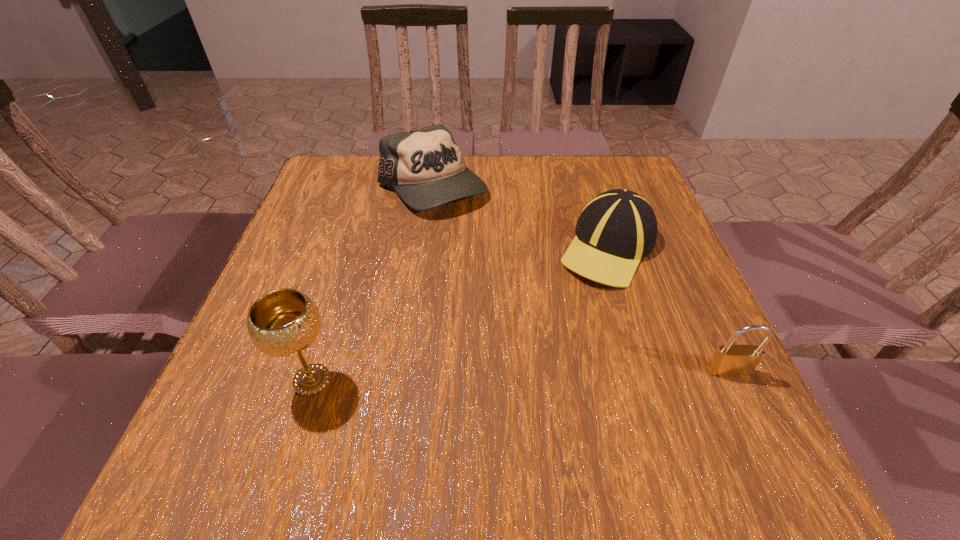
At what (x,y) coordinates should I click in order to perform the action: click on blank space located 0.240m on the front-facing side of the left baseball cap. Please return your answer as a coordinate pair (x, y). Looking at the image, I should click on (487, 282).

This screenshot has height=540, width=960. Find the location of `vacant space situated 0.230m on the front-facing side of the left baseball cap`. vacant space situated 0.230m on the front-facing side of the left baseball cap is located at coordinates (485, 279).

You are a GUI agent. You are given a task and a screenshot of the screen. Output one action in this format:
    pyautogui.click(x=<x>, y=<y>)
    Task: Click on the object situated at the far edge
    This screenshot has height=540, width=960.
    Given the screenshot: What is the action you would take?
    pyautogui.click(x=426, y=167)

The image size is (960, 540). I want to click on chalice located in the near edge section of the desktop, so click(x=284, y=322).

I want to click on padlock that is at the near edge, so 728,360.

Image resolution: width=960 pixels, height=540 pixels. Find the location of `object present at the left edge`. object present at the left edge is located at coordinates (284, 322).

Where is `padlock that is at the right edge`? Image resolution: width=960 pixels, height=540 pixels. padlock that is at the right edge is located at coordinates (728, 360).

Where is `baseball cap that is at the right edge`? baseball cap that is at the right edge is located at coordinates (616, 229).

At what (x,y) coordinates should I click in order to perform the action: click on object positioned at the near left corner. Please return your answer as a coordinate pair (x, y). The height and width of the screenshot is (540, 960). Looking at the image, I should click on (284, 322).

Locate an element on the screen. The image size is (960, 540). object present at the near right corner is located at coordinates (728, 360).